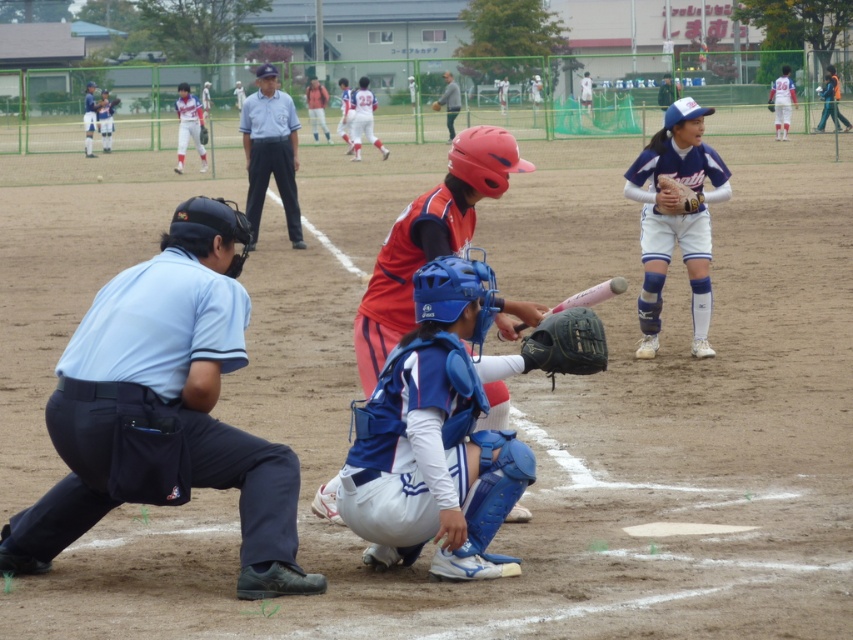
Question: Which point is closer to the camera taking this photo?

Choices:
 (A) (206, 132)
 (B) (184, 241)
 (C) (660, 180)

Answer: (B)

Question: Is dark brown leather glove at lower center positioned in front of pink matte baseball bat at center?

Choices:
 (A) yes
 (B) no

Answer: (A)

Question: Based on their relative distances, which object is nearer to the dark brown leather glove at lower center?

Choices:
 (A) white uniform at upper center
 (B) blue padded catcher at center
 (C) reddish-brown uniform at center
 (D) dark blue leather glove at center

Answer: (B)

Question: Is reddish-brown uniform at center further to camera compared to gray fabric jacket at center?

Choices:
 (A) yes
 (B) no

Answer: (B)

Question: Does light blue uniform at center have a larger size compared to reddish-brown uniform at center?

Choices:
 (A) yes
 (B) no

Answer: (A)

Question: Which object is farther from the camera taking this photo?

Choices:
 (A) dark brown leather glove at lower center
 (B) pink matte baseball bat at center
 (C) dark blue leather glove at center
 (D) white uniform at upper center

Answer: (C)